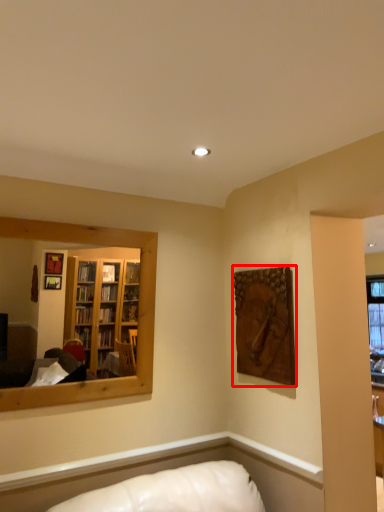
Question: From the image, what is the correct spatial relationship of picture frame (annotated by the red box) in relation to mirror?

Choices:
 (A) left
 (B) right

Answer: (B)